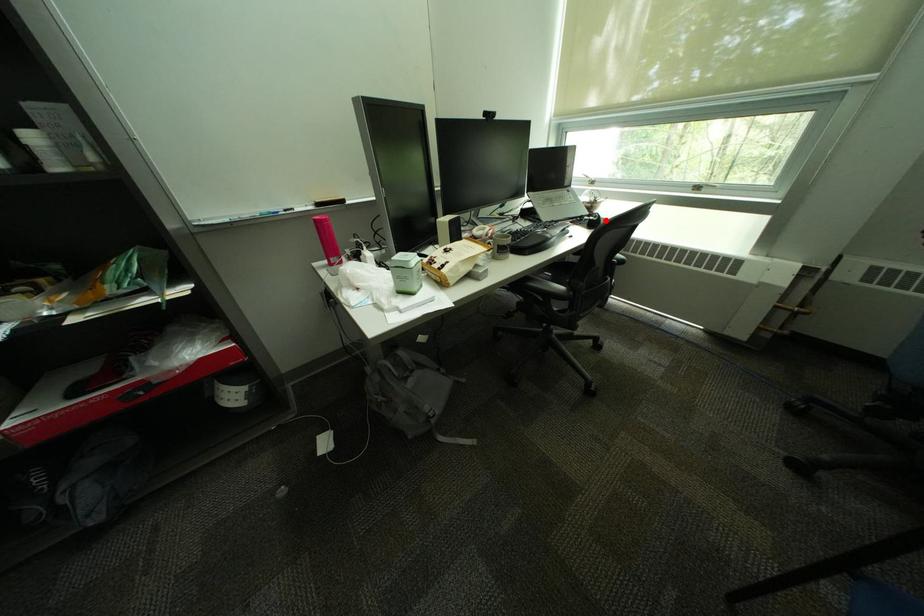
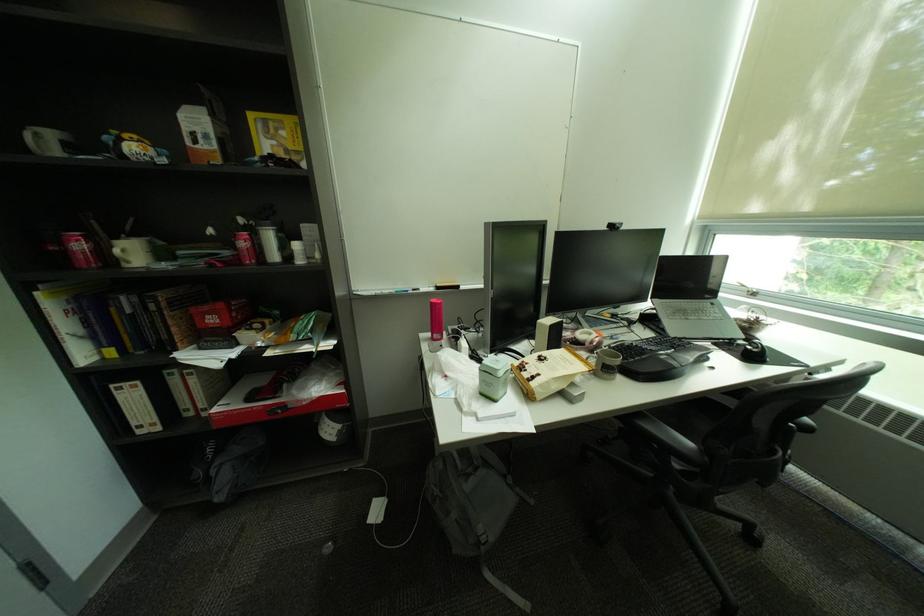
Locate, in the second image, the point that corresponds to the highlighted location in the first image.

(766, 352)